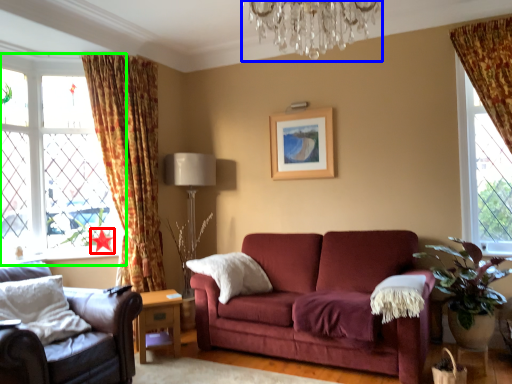
Question: Which object is positioned farthest from star (highlighted by a red box)? Select from light fixture (highlighted by a blue box) and window (highlighted by a green box).

Choices:
 (A) light fixture
 (B) window

Answer: (A)